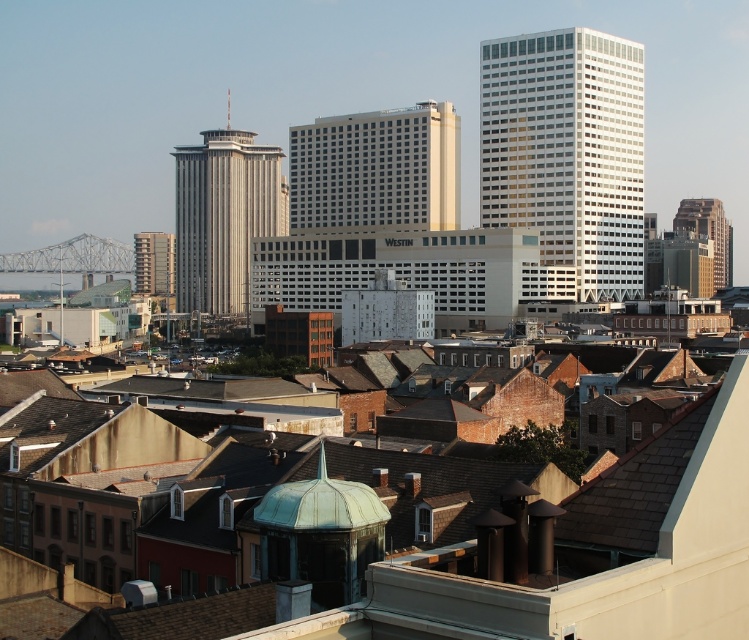
You are a city planner reviewing the city layout. You need to determine if the green copper dome at center can be seen from the observation deck of the white glass skyscraper at upper right. Based on their relative positions and sizes, what would you conclude?

The green copper dome at center is thinner than the white glass skyscraper at upper right, so it is possible that the dome could be visible from the observation deck if there are no obstructions between them. However, the answer should strictly use the given description without adding assumptions. Since the description only mentions the dome being thinner, not taller, the vertical positioning isn

You are an urban planner assessing the cityscape. You need to determine which structure is taller between the green copper dome at center and the white glass skyscraper at upper right based on the scene. Which one is taller?

The white glass skyscraper at upper right is taller than the green copper dome at center according to the description.

You are a drone operator tasked with flying a drone between the gold glass skyscraper at right and the matte gray building at center. The drone has a maximum flight distance of 150 meters. Can the drone safely travel between these two buildings without exceeding its range?

A: The gold glass skyscraper at right and matte gray building at center are 155.06 meters apart from each other. Since the drone has a maximum flight distance of 150 meters, it cannot safely travel between them without exceeding its range.